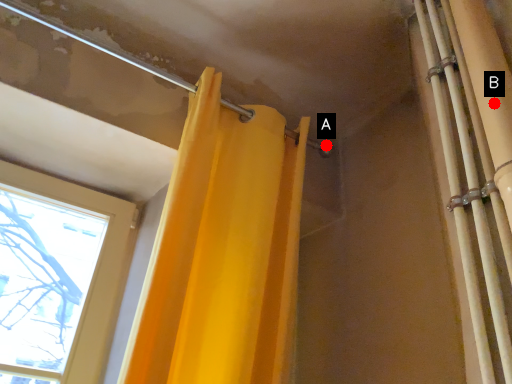
Question: Two points are circled on the image, labeled by A and B beside each circle. Which point is farther from the camera taking this photo?

Choices:
 (A) A is further
 (B) B is further

Answer: (A)